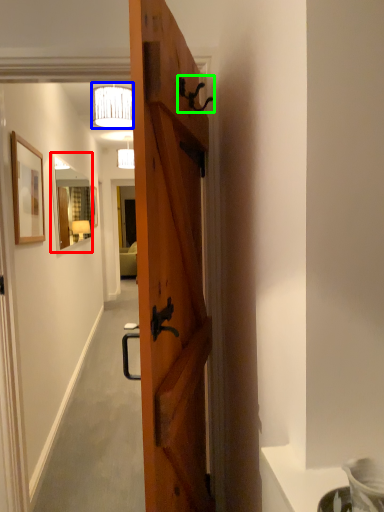
Question: Considering the real-world distances, which object is closest to mirror (highlighted by a red box)? lamp (highlighted by a blue box) or door handle (highlighted by a green box).

Choices:
 (A) lamp
 (B) door handle

Answer: (A)